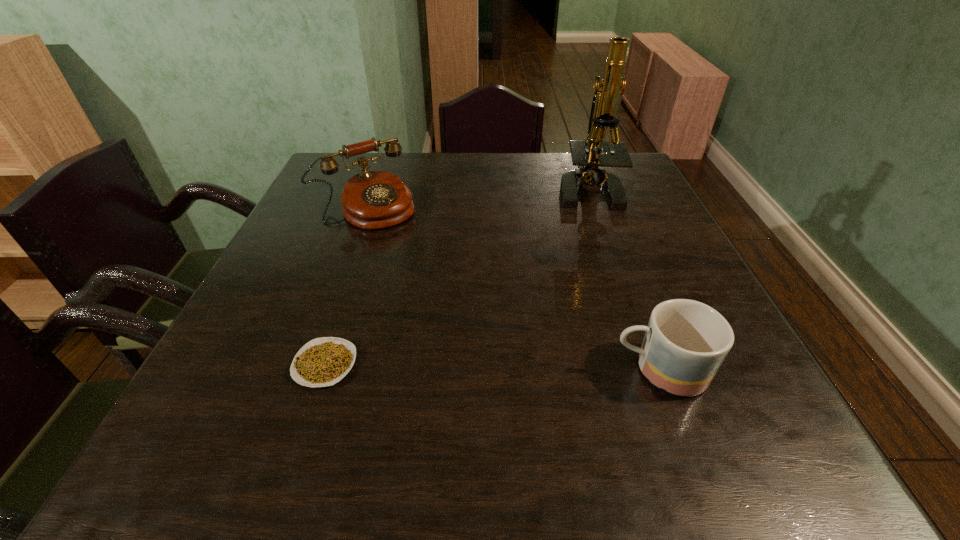
You are a GUI agent. You are given a task and a screenshot of the screen. Output one action in this format:
    pyautogui.click(x=<x>, y=<y>)
    Task: Click on the vacant space in between the third shortest object and the legume
    This screenshot has width=960, height=540.
    Given the screenshot: What is the action you would take?
    pyautogui.click(x=346, y=286)

At what (x,y) coordinates should I click in order to perform the action: click on vacant region between the third tallest object and the tallest object. Please return your answer as a coordinate pair (x, y). Looking at the image, I should click on (623, 279).

Identify the location of vacant area between the shortest object and the mug. This screenshot has height=540, width=960. (492, 368).

The height and width of the screenshot is (540, 960). Find the location of `the third closest object to the telephone`. the third closest object to the telephone is located at coordinates (686, 341).

Identify which object is the nearest to the microscope. Please provide its 2D coordinates. Your answer should be formatted as a tuple, i.e. [(x, y)], where the tuple contains the x and y coordinates of a point satisfying the conditions above.

[(371, 200)]

Locate an element on the screen. The image size is (960, 540). free region that satisfies the following two spatial constraints: 1. on the front side of the telephone; 2. on the side with the handle of the mug is located at coordinates (307, 370).

Identify the location of free space that satisfies the following two spatial constraints: 1. on the front side of the mug; 2. on the side with the handle of the microscope. The width and height of the screenshot is (960, 540). (655, 370).

The height and width of the screenshot is (540, 960). Find the location of `free spot that satisfies the following two spatial constraints: 1. on the front side of the second shortest object; 2. on the side with the handle of the tallest object`. free spot that satisfies the following two spatial constraints: 1. on the front side of the second shortest object; 2. on the side with the handle of the tallest object is located at coordinates (655, 370).